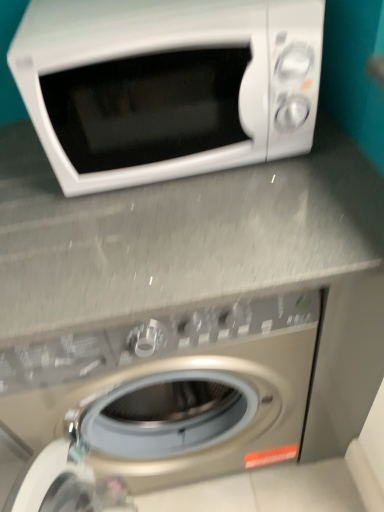
What do you see at coordinates (167, 85) in the screenshot? This screenshot has height=512, width=384. I see `white glossy microwave at upper center` at bounding box center [167, 85].

Find the location of `white glossy microwave at upper center`. white glossy microwave at upper center is located at coordinates (167, 85).

This screenshot has height=512, width=384. What are the coordinates of `white glossy microwave at upper center` in the screenshot? It's located at (167, 85).